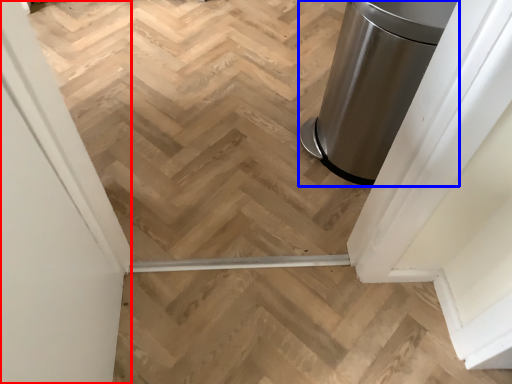
Question: Among these objects, which one is nearest to the camera, screen door (highlighted by a red box) or waste container (highlighted by a blue box)?

Choices:
 (A) screen door
 (B) waste container

Answer: (A)